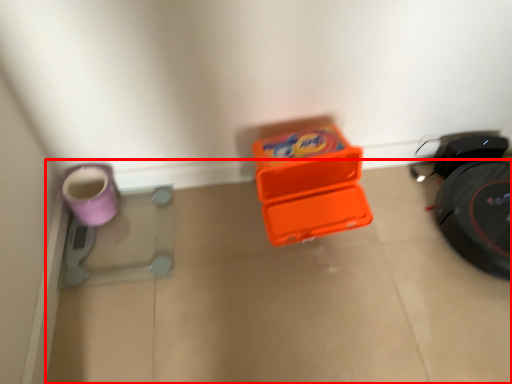
Question: From the image's perspective, where is concrete (annotated by the red box) located relative to footwear?

Choices:
 (A) above
 (B) below

Answer: (B)